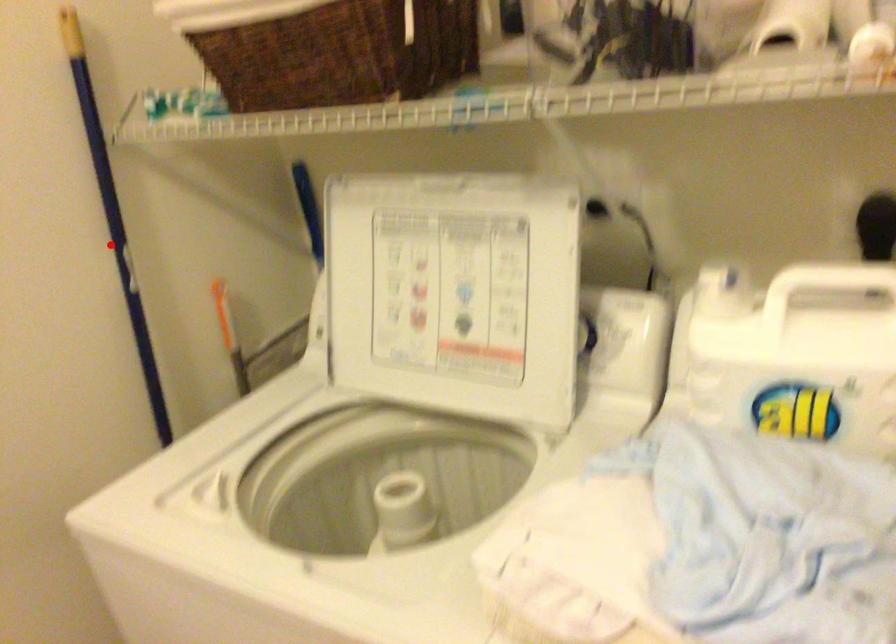
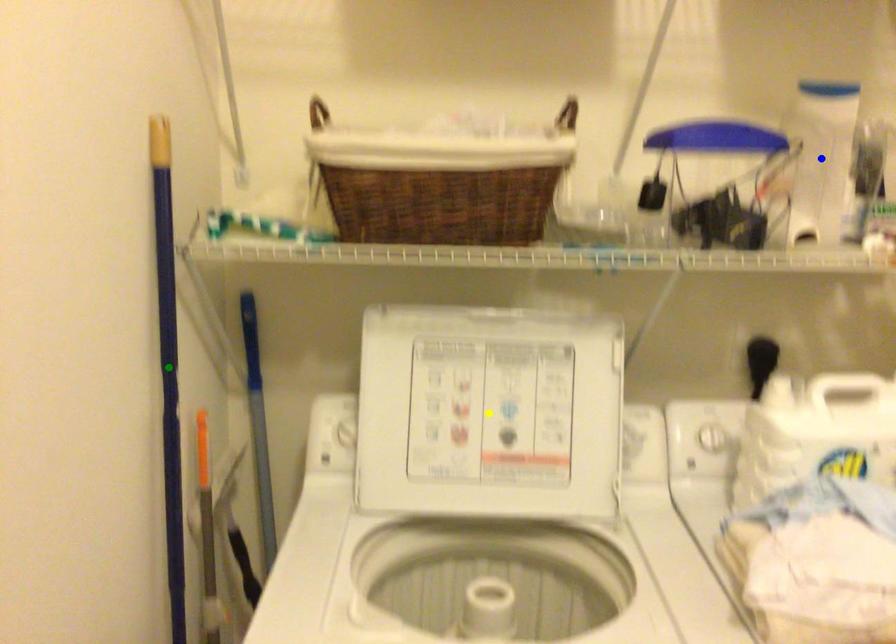
Question: I am providing you with two images of the same scene from different viewpoints. A red point is marked on the first image. You are given multiple points on the second image. Which point in image 2 represents the same 3d spot as the red point in image 1?

Choices:
 (A) blue point
 (B) yellow point
 (C) green point

Answer: (C)